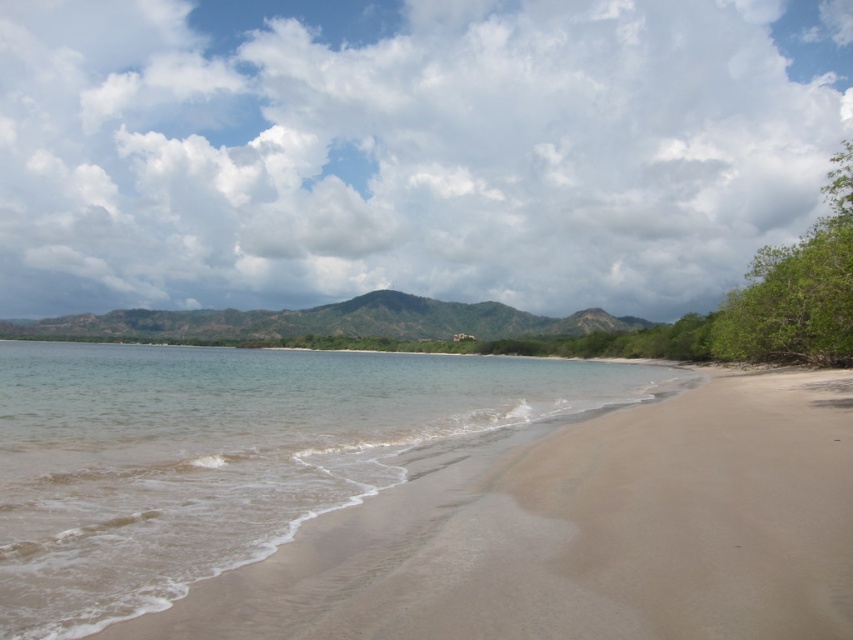
Question: Is clear water at beach center bigger than green textured mountain at center?

Choices:
 (A) yes
 (B) no

Answer: (B)

Question: Can you confirm if clear water at beach center is positioned below green textured mountain at center?

Choices:
 (A) no
 (B) yes

Answer: (B)

Question: Which point is farther to the camera?

Choices:
 (A) green textured mountain at center
 (B) clear water at beach center

Answer: (A)

Question: Which point appears closest to the camera in this image?

Choices:
 (A) (157, 324)
 (B) (190, 486)

Answer: (B)

Question: Which point is closer to the camera?

Choices:
 (A) (213, 529)
 (B) (144, 326)

Answer: (A)

Question: Observing the image, what is the correct spatial positioning of clear water at beach center in reference to green textured mountain at center?

Choices:
 (A) above
 (B) below

Answer: (B)